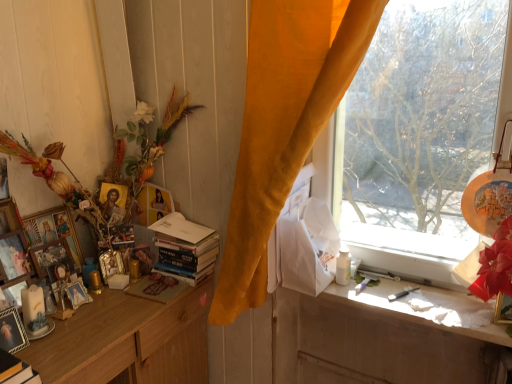
Identify the location of free spot to the right of white glossy bottle at window. (377, 299).